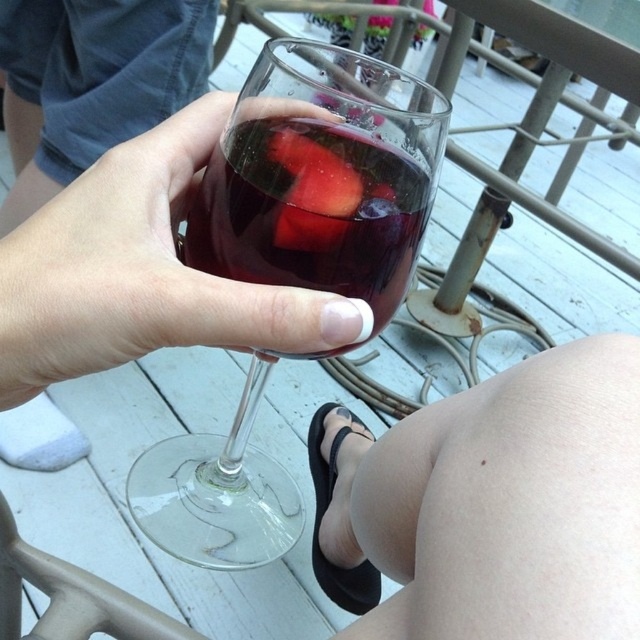
You are a photographer trying to capture the reflection of the smooth skin at lower right in the transparent glass at center. Based on their positions, can you confirm if this reflection will be visible in the glass?

The smooth skin at lower right is closer to the viewer than the transparent glass at center, so its reflection would not be visible in the glass because the glass is farther away and the reflection would require the skin to be behind the glass relative to the viewer.

You are at a party and want to choose a glass to serve a drink. You have two options in front of you, the matte glass at center and the clear glass wine glass at center. Based on their height, which one would you pick if you prefer a taller glass?

The clear glass wine glass at center is taller than the matte glass at center, so you should choose the clear glass wine glass at center if you prefer a taller glass.

You are a photographer taking a close up shot of a hand holding a wine glass. You notice a point at coordinates (500, 502) in the image. Based on the scene description, where is this point located?

The point at coordinates (500, 502) is on smooth skin at lower right.